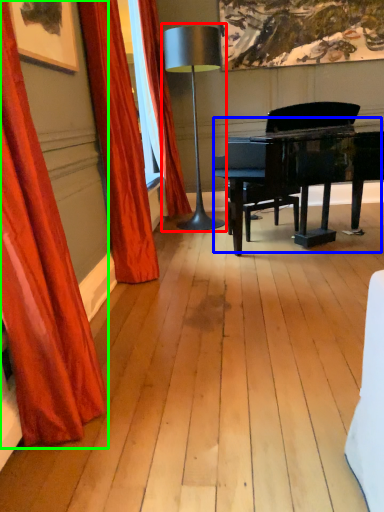
Question: Based on their relative distances, which object is farther from table lamp (highlighted by a red box)? Choose from piano (highlighted by a blue box) and curtain (highlighted by a green box).

Choices:
 (A) piano
 (B) curtain

Answer: (B)